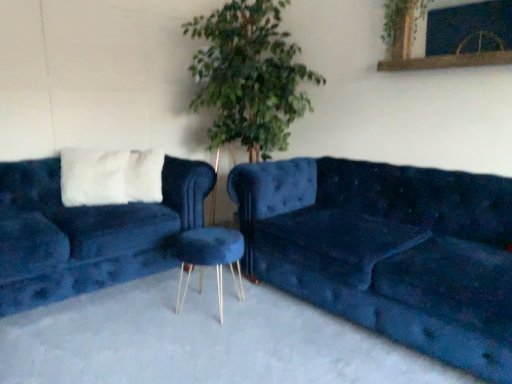
Where is `vacant space situated on the left part of velvet blue couch at right, which is counted as the second studio couch, starting from the left`? vacant space situated on the left part of velvet blue couch at right, which is counted as the second studio couch, starting from the left is located at coordinates (180, 334).